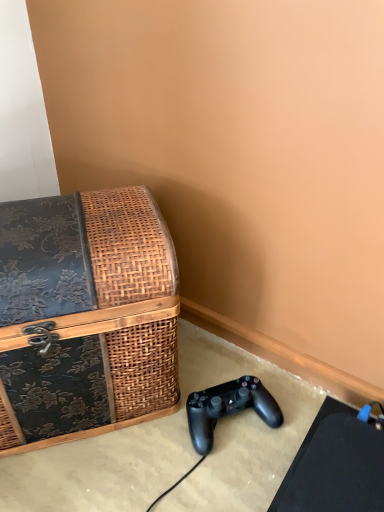
This screenshot has height=512, width=384. I want to click on free space in front of black matte game controller at lower right, so click(x=227, y=480).